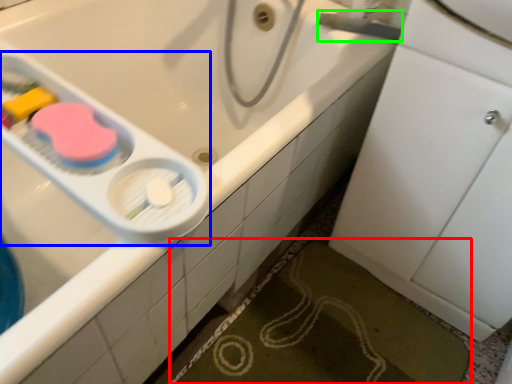
Question: Considering the real-world distances, which object is farthest from bath mat (highlighted by a red box)? scale (highlighted by a blue box) or plumbing fixture (highlighted by a green box)?

Choices:
 (A) scale
 (B) plumbing fixture

Answer: (B)